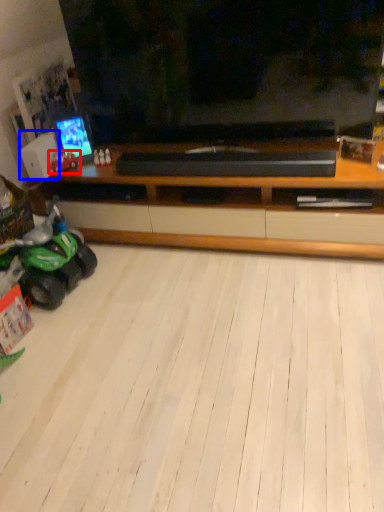
Question: Among these objects, which one is nearest to the camera, land vehicle (highlighted by a red box) or speaker (highlighted by a blue box)?

Choices:
 (A) land vehicle
 (B) speaker

Answer: (B)